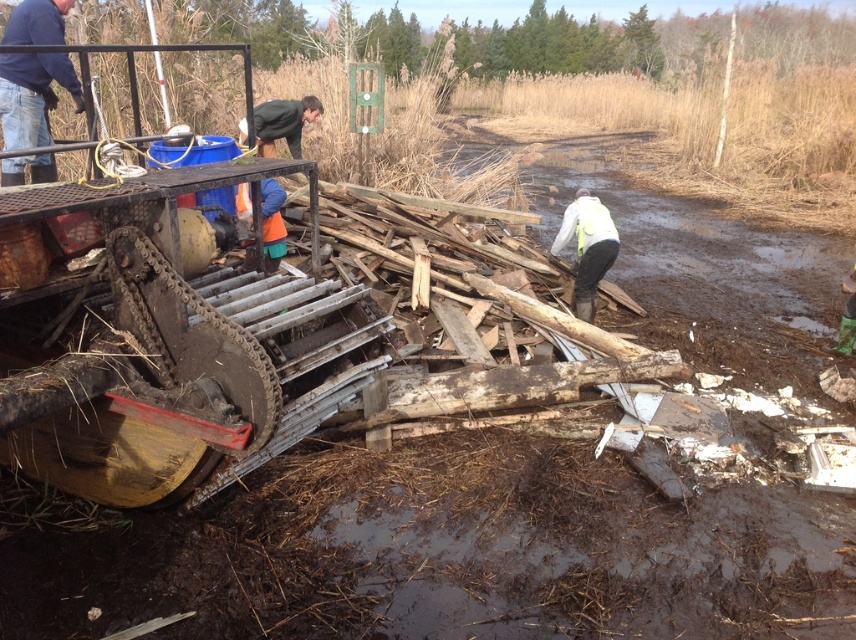
Question: Which object is farther from the camera taking this photo?

Choices:
 (A) green matte jacket at upper center
 (B) white matte jacket at center
 (C) blue denim jeans at upper left

Answer: (A)

Question: Estimate the real-world distances between objects in this image. Which object is closer to the white matte jacket at center?

Choices:
 (A) green matte jacket at upper center
 (B) blue denim jeans at upper left

Answer: (A)

Question: Estimate the real-world distances between objects in this image. Which object is closer to the blue denim jeans at upper left?

Choices:
 (A) white matte jacket at center
 (B) green matte jacket at upper center

Answer: (B)

Question: Is white matte jacket at center positioned in front of green matte jacket at upper center?

Choices:
 (A) no
 (B) yes

Answer: (B)

Question: Observing the image, what is the correct spatial positioning of blue denim jeans at upper left in reference to white matte jacket at center?

Choices:
 (A) left
 (B) right

Answer: (A)

Question: From the image, what is the correct spatial relationship of white matte jacket at center in relation to green matte jacket at upper center?

Choices:
 (A) above
 (B) below

Answer: (B)